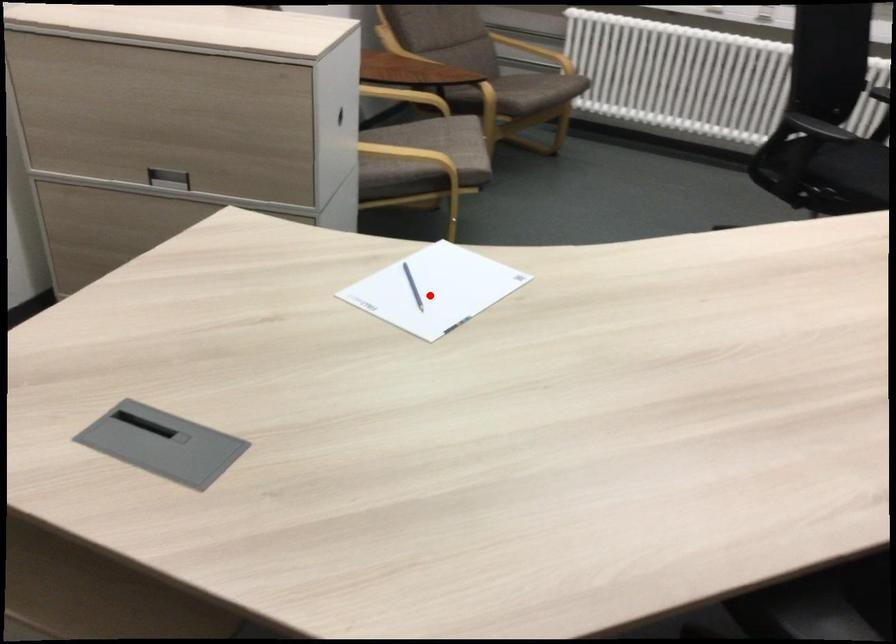
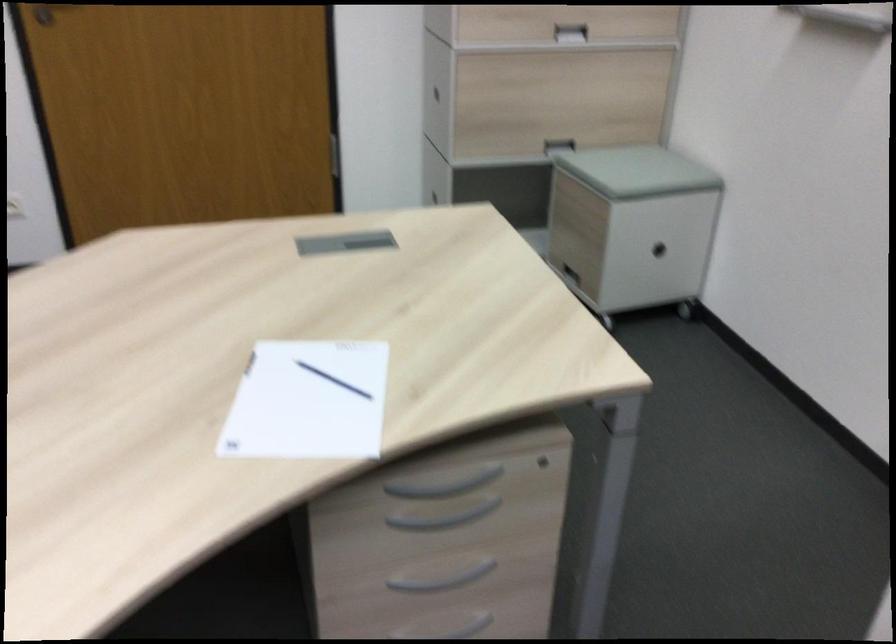
Find the pixel in the second image that matches the highlighted location in the first image.

(307, 402)